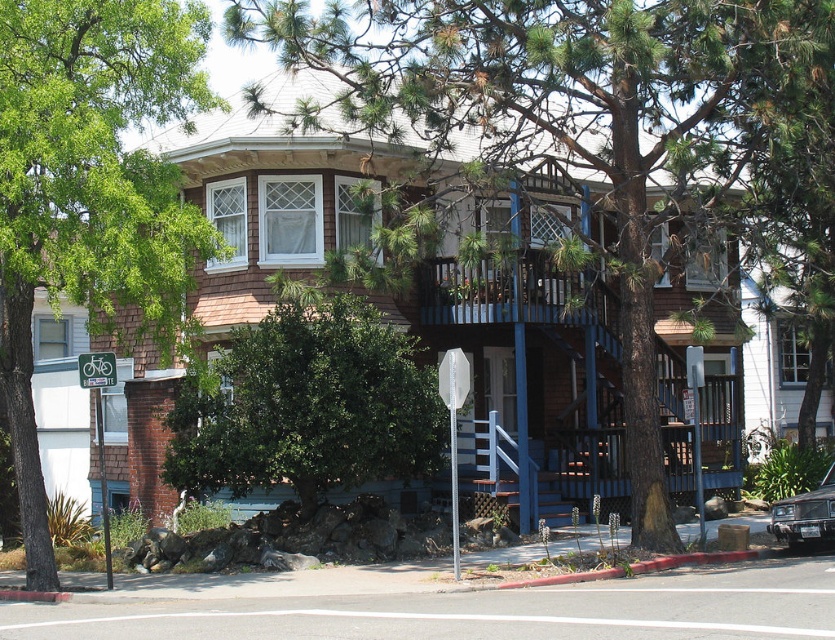
You are a visitor arriving at the house and want to park your car, which is the same size as the metallic silver car at lower right. There is a space near the green leafy tree at upper left. Will your car fit in that space?

The green leafy tree at upper left is bigger than the metallic silver car at lower right. Since your car is the same size as the metallic silver car at lower right, the space near the green leafy tree at upper left should be sufficient for parking, as the tree is larger and likely provides enough space.

You are standing in front of the house and want to plant a new tree exactly where the green leafy tree at upper left is currently located. What are the coordinates you should use for planting?

The coordinates for planting the new tree should be at point (89, 189), which is where the green leafy tree at upper left is currently located.

You are standing in front of the house and want to hang a new welcome mat. The green leafy tree at lower center and the metallic bicycle sign at upper left are in your view. Which object is closer to the ground?

The green leafy tree at lower center is closer to the ground because it is located below the metallic bicycle sign at upper left.